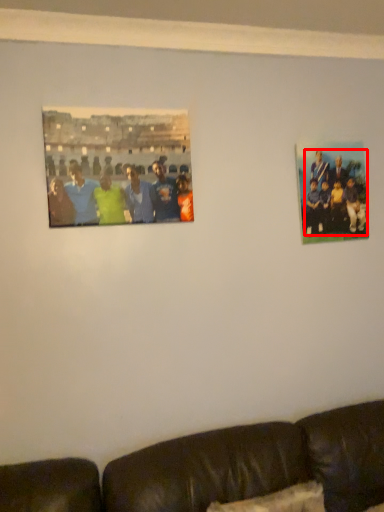
Question: From the image's perspective, where is person (annotated by the red box) located relative to picture frame?

Choices:
 (A) above
 (B) below

Answer: (B)